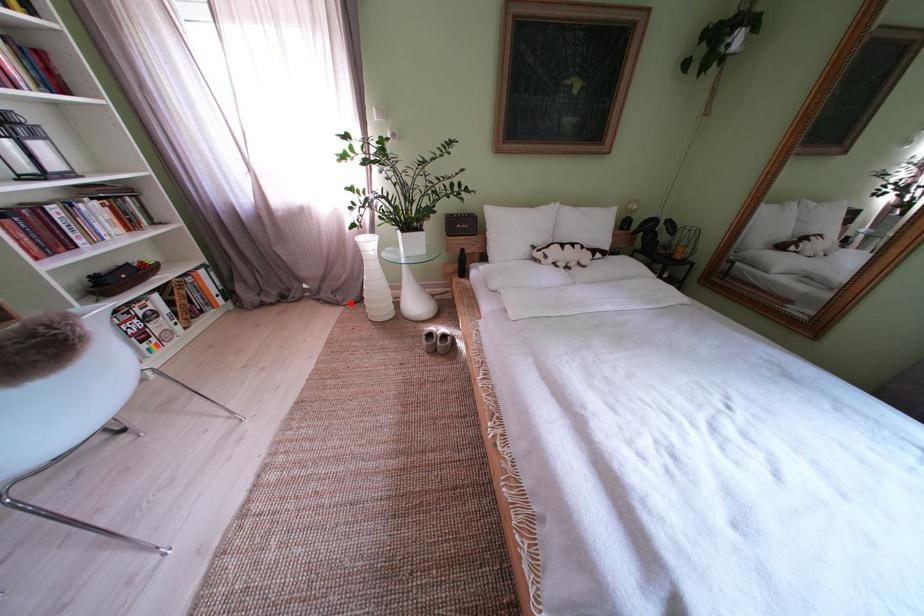
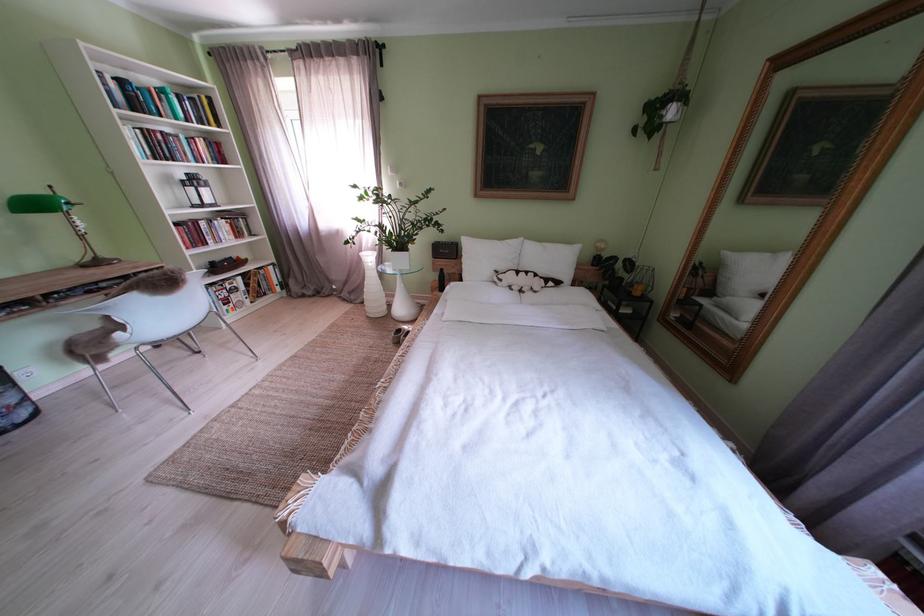
Question: I am providing you with two images of the same scene from different viewpoints. In image1, a red point is highlighted. Considering the same 3D point in image2, which of the following is correct?

Choices:
 (A) It is closer
 (B) It is farther

Answer: (B)